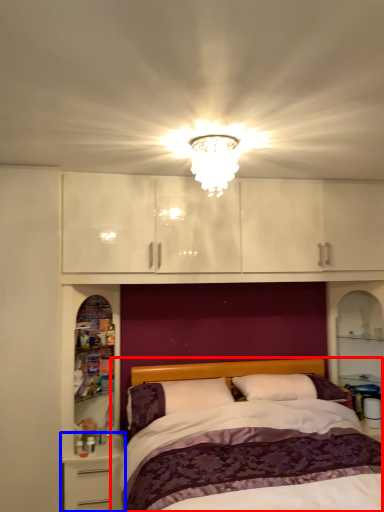
Question: Which object is closer to the camera taking this photo, bed (highlighted by a red box) or nightstand (highlighted by a blue box)?

Choices:
 (A) bed
 (B) nightstand

Answer: (A)